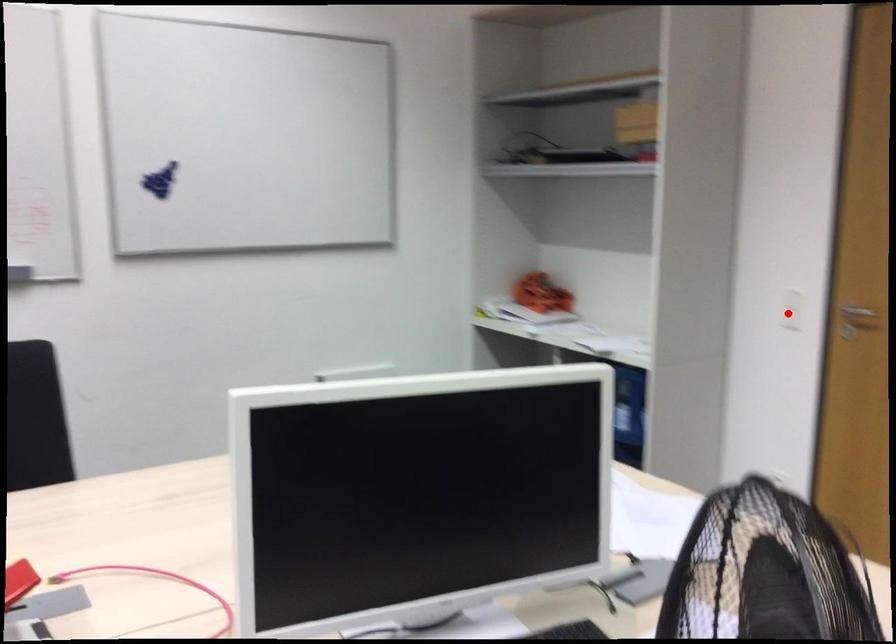
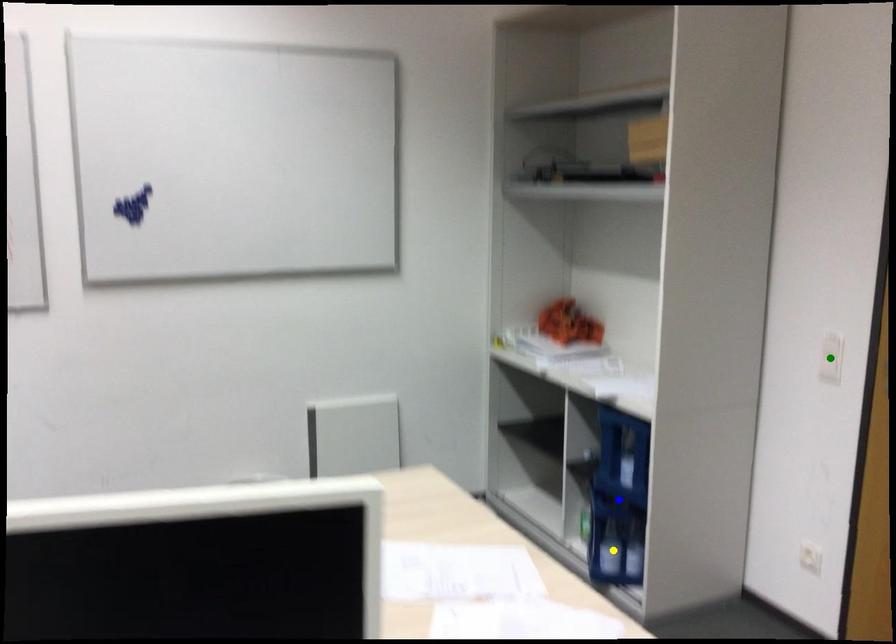
Question: I am providing you with two images of the same scene from different viewpoints. A red point is marked on the first image. You are given multiple points on the second image. Which mark in image 2 goes with the point in image 1?

Choices:
 (A) blue point
 (B) yellow point
 (C) green point

Answer: (C)